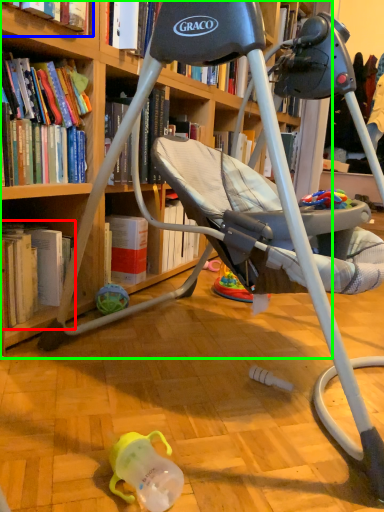
Question: Which object is positioned farthest from book (highlighted by a red box)? Select from book (highlighted by a blue box) and bookcase (highlighted by a green box).

Choices:
 (A) book
 (B) bookcase

Answer: (A)